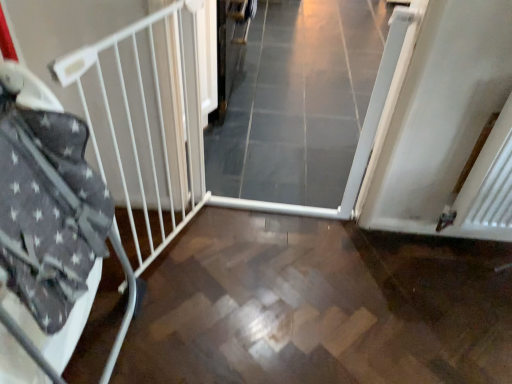
Measure the distance between point [428,374] and camera.

The depth of point [428,374] is 4.55 feet.

Identify the location of white metal bed frame at left. This screenshot has height=384, width=512. (95, 178).

Describe the element at coordinates (95, 178) in the screenshot. I see `white metal bed frame at left` at that location.

Measure the distance between point (303, 48) and camera.

Point (303, 48) and camera are 10.25 feet apart from each other.

This screenshot has height=384, width=512. What do you see at coordinates (305, 107) in the screenshot? I see `white glossy door at center` at bounding box center [305, 107].

Find the location of a particular element. wooden floor at center is located at coordinates (319, 306).

Considering the relative sizes of white metal bed frame at left and wooden floor at center in the image provided, is white metal bed frame at left smaller than wooden floor at center?

Yes, white metal bed frame at left is smaller than wooden floor at center.

Could you tell me if white metal bed frame at left is facing wooden floor at center?

Yes, white metal bed frame at left faces towards wooden floor at center.

Is white metal bed frame at left located outside wooden floor at center?

Indeed, white metal bed frame at left is completely outside wooden floor at center.

Which is in front, point (84, 196) or point (288, 234)?

The point (84, 196) is closer to the camera.

Who is bigger, white metal bed frame at left or white glossy door at center?

With larger size is white glossy door at center.

How far apart are white metal bed frame at left and white glossy door at center?

white metal bed frame at left is 36.38 inches from white glossy door at center.

From the image's perspective, which one is positioned lower, white metal bed frame at left or white glossy door at center?

white metal bed frame at left appears lower in the image.

Consider the image. From a real-world perspective, is wooden floor at center physically located above or below white metal bed frame at left?

From a real-world perspective, wooden floor at center is physically below white metal bed frame at left.

From the image's perspective, would you say wooden floor at center is shown under white metal bed frame at left?

Yes, from the image's perspective, wooden floor at center is beneath white metal bed frame at left.

Is wooden floor at center facing away from white metal bed frame at left?

wooden floor at center is not turned away from white metal bed frame at left.

Is white glossy door at center not inside wooden floor at center?

Yes, white glossy door at center is located beyond the bounds of wooden floor at center.

Measure the distance between white glossy door at center and wooden floor at center.

A distance of 33.15 inches exists between white glossy door at center and wooden floor at center.

Can you confirm if white glossy door at center is thinner than wooden floor at center?

No, white glossy door at center is not thinner than wooden floor at center.

At what (x,y) coordinates should I click in order to perform the action: click on path below the white glossy door at center (from a real-world perspective). Please return your answer as a coordinate pair (x, y). The height and width of the screenshot is (384, 512). Looking at the image, I should click on (319, 306).

Locate an element on the screen. path on the left of the white glossy door at center is located at coordinates (319, 306).

Is wooden floor at center aimed at white glossy door at center?

No, wooden floor at center is not turned towards white glossy door at center.

From a real-world perspective, who is located higher, wooden floor at center or white glossy door at center?

From a 3D spatial view, white glossy door at center is above.

Is the position of white glossy door at center more distant than that of white metal bed frame at left?

Yes, white glossy door at center is further from the camera.

From a real-world perspective, is white glossy door at center under white metal bed frame at left?

Yes, from a real-world perspective, white glossy door at center is beneath white metal bed frame at left.

Considering the positions of points (228, 144) and (122, 152), is point (228, 144) farther from camera compared to point (122, 152)?

Yes, point (228, 144) is farther from viewer.

Is white glossy door at center beside white metal bed frame at left?

No, white glossy door at center is not next to white metal bed frame at left.

You are a GUI agent. You are given a task and a screenshot of the screen. Output one action in this format:
    pyautogui.click(x=<x>, y=<y>)
    Task: Click on the bed frame above the wooden floor at center (from a real-world perspective)
    This screenshot has height=384, width=512.
    Given the screenshot: What is the action you would take?
    pyautogui.click(x=95, y=178)

Where is `bed frame that appears in front of the white glossy door at center`? This screenshot has width=512, height=384. bed frame that appears in front of the white glossy door at center is located at coordinates (95, 178).

Based on the photo, estimate the real-world distances between objects in this image. Which object is further from wooden floor at center, white metal bed frame at left or white glossy door at center?

The object further to wooden floor at center is white glossy door at center.

Estimate the real-world distances between objects in this image. Which object is closer to wooden floor at center, white glossy door at center or white metal bed frame at left?

white metal bed frame at left is positioned closer to the anchor wooden floor at center.

Based on their spatial positions, is wooden floor at center or white glossy door at center further from white metal bed frame at left?

white glossy door at center is further to white metal bed frame at left.

Which object lies nearer to the anchor point white metal bed frame at left, white glossy door at center or wooden floor at center?

wooden floor at center is closer to white metal bed frame at left.

When comparing their distances from white glossy door at center, does wooden floor at center or white metal bed frame at left seem closer?

wooden floor at center lies closer to white glossy door at center than the other object.

When comparing their distances from white glossy door at center, does white metal bed frame at left or wooden floor at center seem further?

Based on the image, white metal bed frame at left appears to be further to white glossy door at center.

At what (x,y) coordinates should I click in order to perform the action: click on bed frame between white glossy door at center and wooden floor at center from top to bottom. Please return your answer as a coordinate pair (x, y). The height and width of the screenshot is (384, 512). Looking at the image, I should click on (95, 178).